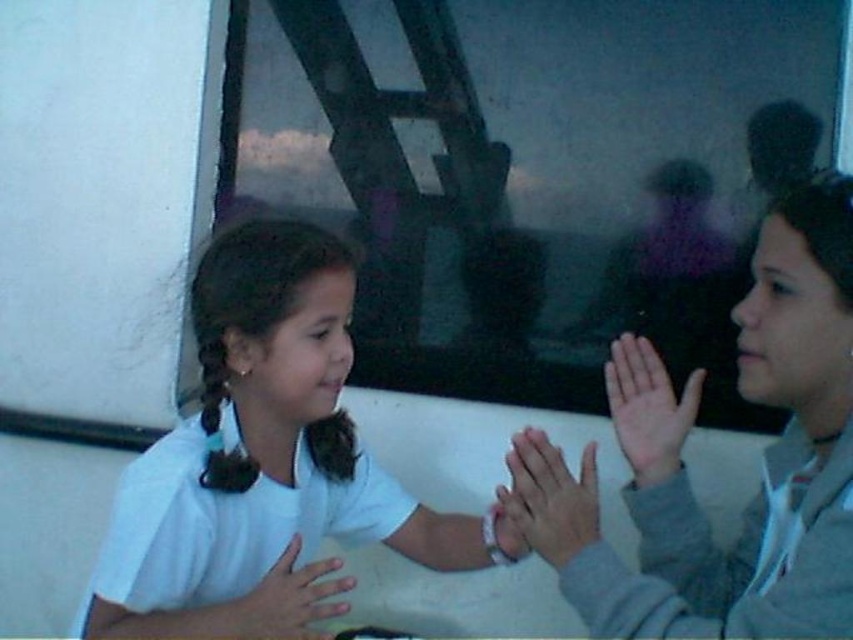
Looking at this image, is white matte shirt at center below smooth white hand at center?

Actually, white matte shirt at center is above smooth white hand at center.

In order to click on white matte shirt at center in this screenshot , I will do `click(265, 460)`.

The width and height of the screenshot is (853, 640). Find the location of `white matte shirt at center`. white matte shirt at center is located at coordinates (265, 460).

Does gray fleece jacket at right have a lesser height compared to smooth skin hands at center?

Incorrect, gray fleece jacket at right's height does not fall short of smooth skin hands at center's.

Which is above, gray fleece jacket at right or smooth skin hands at center?

Positioned higher is gray fleece jacket at right.

You are a GUI agent. You are given a task and a screenshot of the screen. Output one action in this format:
    pyautogui.click(x=<x>, y=<y>)
    Task: Click on the gray fleece jacket at right
    
    Given the screenshot: What is the action you would take?
    pyautogui.click(x=683, y=467)

This screenshot has width=853, height=640. I want to click on gray fleece jacket at right, so click(683, 467).

Is white matte shirt at center to the right of smooth skin hand at center from the viewer's perspective?

Incorrect, white matte shirt at center is not on the right side of smooth skin hand at center.

Is white matte shirt at center shorter than smooth skin hand at center?

No, white matte shirt at center is not shorter than smooth skin hand at center.

Does point (257, 372) come in front of point (630, 452)?

No.

The image size is (853, 640). I want to click on white matte shirt at center, so click(265, 460).